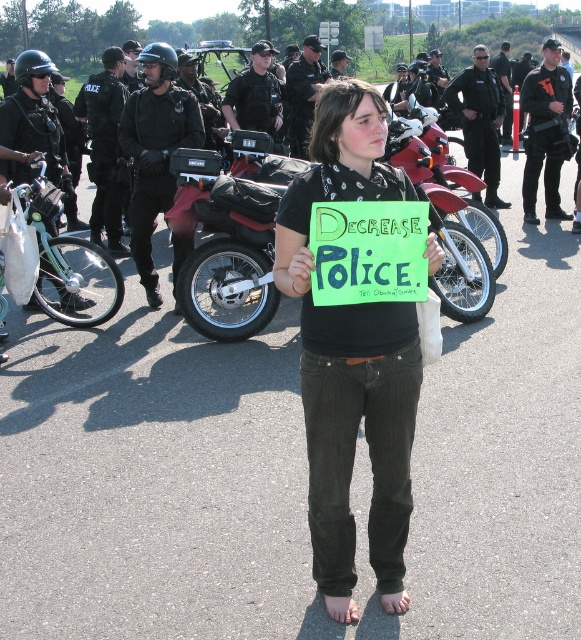
You are a journalist trying to capture the protest scene. You see the black uniformed police at left and the black uniform at center. Which object is positioned more to the left?

The black uniformed police at left is positioned more to the left than the black uniform at center.

You are a photographer trying to capture both the black uniformed police at left and the black uniform at center in a single frame. Based on their positions, which one would appear larger in your photo?

The black uniformed police at left might appear larger in the photo than the black uniform at center because it is wider.